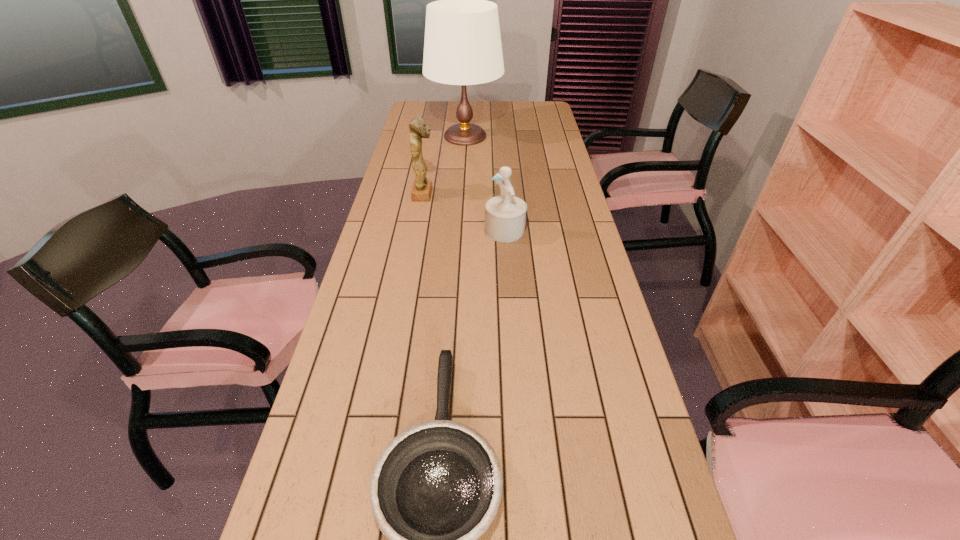
Where is `free space located 0.260m at the beak of the nearer figurine`? The height and width of the screenshot is (540, 960). free space located 0.260m at the beak of the nearer figurine is located at coordinates (407, 231).

At what (x,y) coordinates should I click in order to perform the action: click on lamp that is at the left edge. Please return your answer as a coordinate pair (x, y). The image size is (960, 540). Looking at the image, I should click on (462, 46).

Where is `figurine present at the left edge`? Image resolution: width=960 pixels, height=540 pixels. figurine present at the left edge is located at coordinates (422, 188).

The height and width of the screenshot is (540, 960). Find the location of `vacant space at the far edge of the desktop`. vacant space at the far edge of the desktop is located at coordinates click(x=496, y=102).

The height and width of the screenshot is (540, 960). In the image, there is a desktop. Find the location of `free space at the left edge`. free space at the left edge is located at coordinates (407, 146).

Identify the location of free location at the right edge of the desktop. (554, 224).

This screenshot has height=540, width=960. I want to click on free space between the second tallest object and the third tallest object, so click(x=465, y=212).

You are a GUI agent. You are given a task and a screenshot of the screen. Output one action in this format:
    pyautogui.click(x=<x>, y=<y>)
    Task: Click on the free space that is in between the lamp and the shorter figurine
    The image size is (960, 540).
    Given the screenshot: What is the action you would take?
    click(485, 184)

The image size is (960, 540). Find the location of `vacant area between the second farthest object and the second nearest object`. vacant area between the second farthest object and the second nearest object is located at coordinates (465, 212).

You are a GUI agent. You are given a task and a screenshot of the screen. Output one action in this format:
    pyautogui.click(x=<x>, y=<y>)
    Task: Click on the free space between the farther figurine and the right figurine
    This screenshot has width=960, height=540.
    Given the screenshot: What is the action you would take?
    pyautogui.click(x=465, y=212)